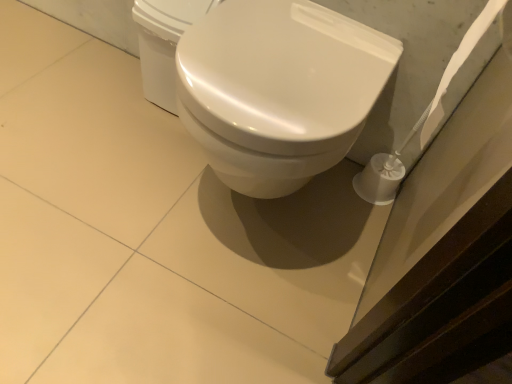
Question: Would you consider white glossy toilet at center to be distant from white glossy toilet at upper center?

Choices:
 (A) no
 (B) yes

Answer: (A)

Question: Does white glossy toilet at center appear on the right side of white glossy toilet at upper center?

Choices:
 (A) yes
 (B) no

Answer: (A)

Question: Is white glossy toilet at center taller than white glossy toilet at upper center?

Choices:
 (A) no
 (B) yes

Answer: (B)

Question: From a real-world perspective, is white glossy toilet at center physically below white glossy toilet at upper center?

Choices:
 (A) no
 (B) yes

Answer: (A)

Question: Are white glossy toilet at center and white glossy toilet at upper center making contact?

Choices:
 (A) yes
 (B) no

Answer: (B)

Question: Can you confirm if white glossy toilet at center is bigger than white glossy toilet at upper center?

Choices:
 (A) no
 (B) yes

Answer: (B)

Question: Can you confirm if white glossy toilet at upper center is wider than white glossy toilet at center?

Choices:
 (A) no
 (B) yes

Answer: (A)

Question: Is white glossy toilet at upper center further to camera compared to white glossy toilet at center?

Choices:
 (A) no
 (B) yes

Answer: (B)

Question: Considering the relative positions of white glossy toilet at upper center and white glossy toilet at center in the image provided, is white glossy toilet at upper center to the left of white glossy toilet at center from the viewer's perspective?

Choices:
 (A) no
 (B) yes

Answer: (B)

Question: Considering the relative sizes of white glossy toilet at upper center and white glossy toilet at center in the image provided, is white glossy toilet at upper center taller than white glossy toilet at center?

Choices:
 (A) yes
 (B) no

Answer: (B)

Question: Is white glossy toilet at center surrounded by white glossy toilet at upper center?

Choices:
 (A) yes
 (B) no

Answer: (B)

Question: Is white glossy toilet at upper center facing towards white glossy toilet at center?

Choices:
 (A) no
 (B) yes

Answer: (A)

Question: Is white glossy toilet at upper center wider or thinner than white glossy toilet at center?

Choices:
 (A) thin
 (B) wide

Answer: (A)